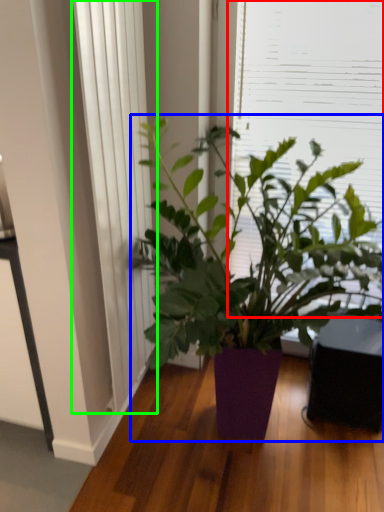
Question: Based on their relative distances, which object is nearer to window screen (highlighted by a red box)? Choose from houseplant (highlighted by a blue box) and curtain (highlighted by a green box).

Choices:
 (A) houseplant
 (B) curtain

Answer: (A)